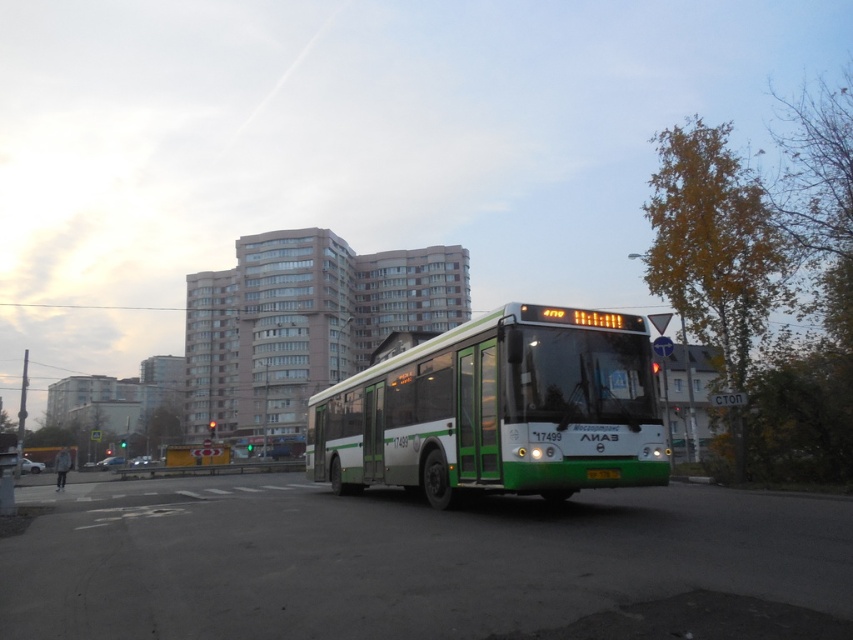
Question: Does green matte bus at center appear on the right side of silver metallic car at lower left?

Choices:
 (A) no
 (B) yes

Answer: (B)

Question: Which of these objects is positioned closest to the silver metallic car at lower left?

Choices:
 (A) green matte bus at center
 (B) metallic silver car at center

Answer: (B)

Question: Does green matte bus at center have a greater width compared to metallic silver car at lower left?

Choices:
 (A) no
 (B) yes

Answer: (A)

Question: Which is farther from the metallic silver car at center?

Choices:
 (A) silver metallic car at lower left
 (B) green matte bus at center
 (C) metallic silver car at lower left

Answer: (B)

Question: Does metallic silver car at center have a lesser width compared to metallic silver car at lower left?

Choices:
 (A) no
 (B) yes

Answer: (B)

Question: Among these points, which one is farthest from the camera?

Choices:
 (A) (434, 444)
 (B) (22, 461)

Answer: (B)